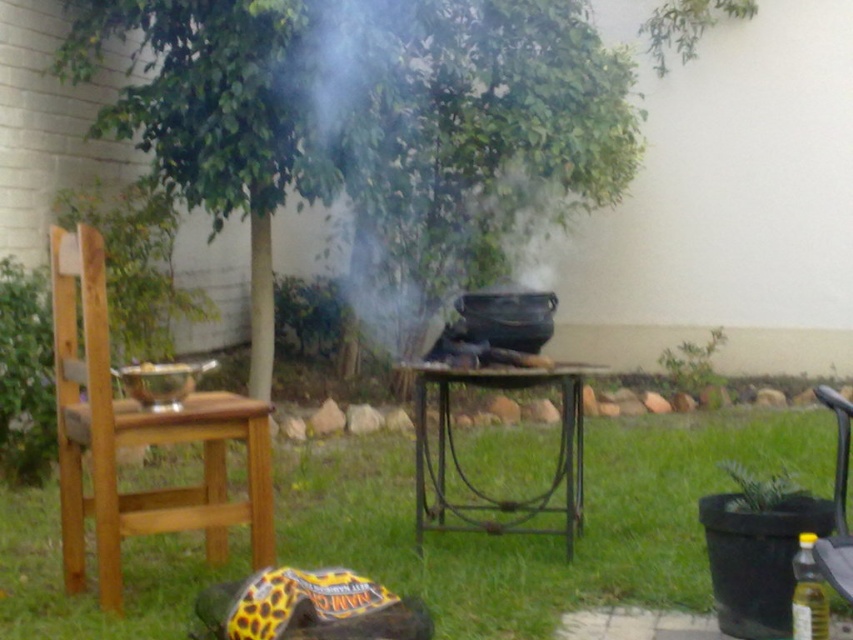
You are standing in the backyard and want to place a large potted plant between the wooden chair at left and the green grass at lower center. Based on their positions, can you determine which object is closer to you so the plant can be placed in front of it?

The wooden chair at left is behind green grass at lower center, so the green grass at lower center is closer to you. Place the potted plant in front of the green grass at lower center.